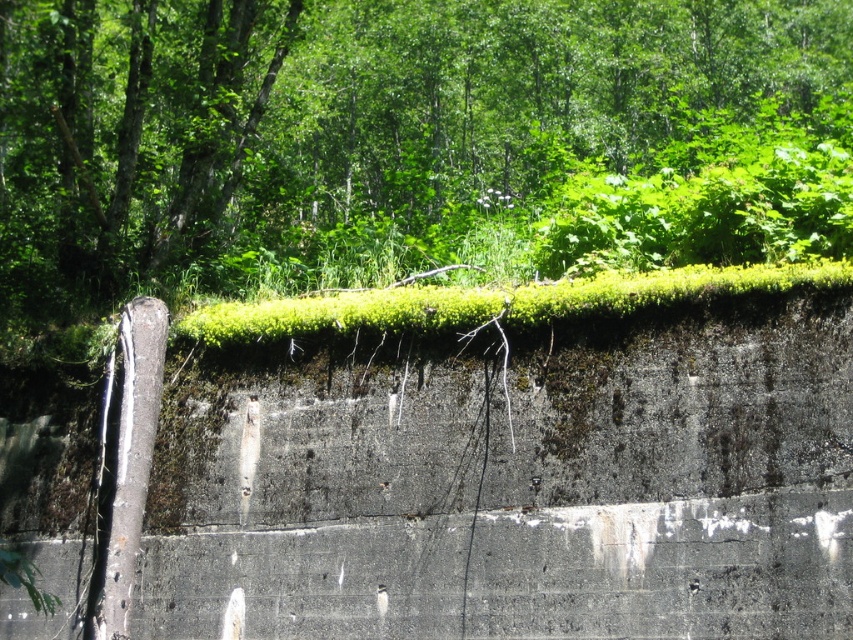
Can you confirm if green mossy concrete at upper center is bigger than green leafy tree at upper center?

Incorrect, green mossy concrete at upper center is not larger than green leafy tree at upper center.

Is green mossy concrete at upper center to the right of green leafy tree at upper center from the viewer's perspective?

Incorrect, green mossy concrete at upper center is not on the right side of green leafy tree at upper center.

Identify the location of green mossy concrete at upper center. (502, 483).